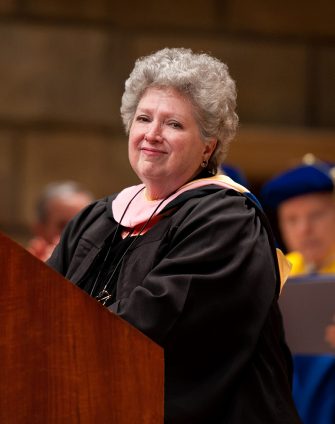
The width and height of the screenshot is (335, 424). Find the location of `podium`. podium is located at coordinates (73, 379).